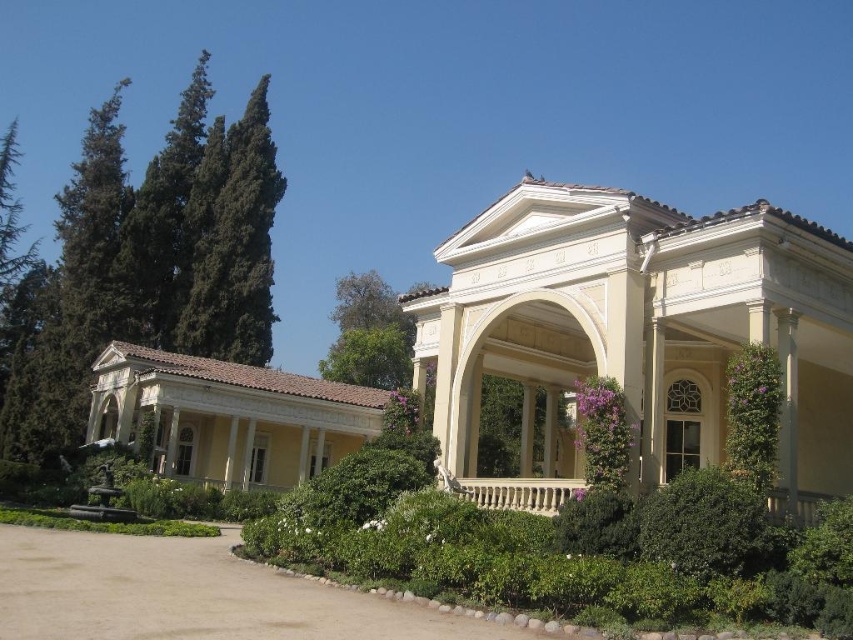
Question: Which point is closer to the camera?

Choices:
 (A) (x=166, y=365)
 (B) (x=778, y=417)
 (C) (x=549, y=480)

Answer: (B)

Question: Which of the following is the closest to the observer?

Choices:
 (A) green leafy hedge at lower right
 (B) white marble porch at center
 (C) green leafy bush at right
 (D) green leafy bush at center

Answer: (A)

Question: Which object is positioned closest to the green leafy hedge at lower right?

Choices:
 (A) white marble porch at center
 (B) green leafy bush at center
 (C) green leafy bush at right
 (D) brown gravel driveway at lower center

Answer: (C)

Question: Is green leafy hedge at lower right smaller than white marble porch at center?

Choices:
 (A) yes
 (B) no

Answer: (A)

Question: Does beige stucco pavilion at center have a larger size compared to green leafy bush at center?

Choices:
 (A) yes
 (B) no

Answer: (A)

Question: Does beige stucco pavilion at center come in front of green leafy hedge at lower right?

Choices:
 (A) yes
 (B) no

Answer: (B)